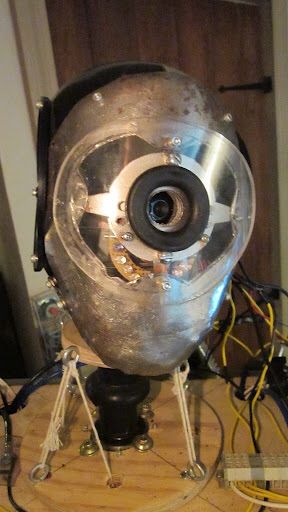
The height and width of the screenshot is (512, 288). I want to click on silver screw, so click(x=129, y=236).